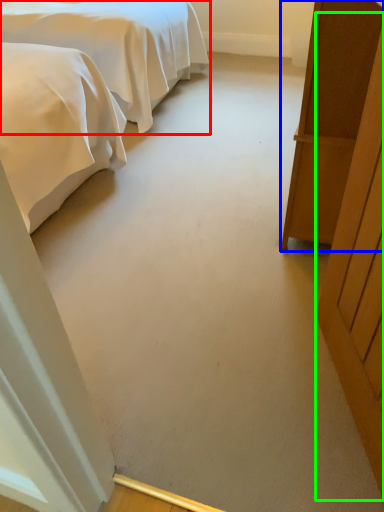
Question: Which object is positioned closest to bed (highlighted by a red box)? Select from furniture (highlighted by a blue box) and door (highlighted by a green box).

Choices:
 (A) furniture
 (B) door

Answer: (A)